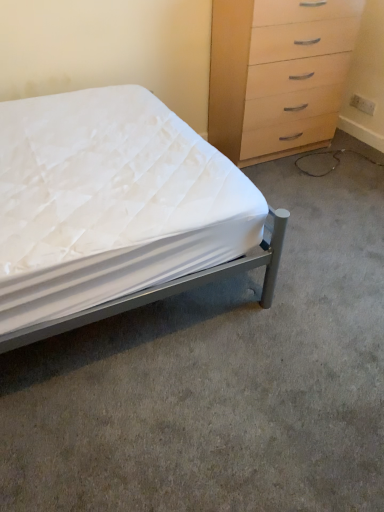
Question: Considering the relative sizes of light wood/wooden chest of drawers at upper right and metallic gray bed at left in the image provided, is light wood/wooden chest of drawers at upper right shorter than metallic gray bed at left?

Choices:
 (A) no
 (B) yes

Answer: (A)

Question: Considering the relative sizes of light wood/wooden chest of drawers at upper right and metallic gray bed at left in the image provided, is light wood/wooden chest of drawers at upper right smaller than metallic gray bed at left?

Choices:
 (A) yes
 (B) no

Answer: (A)

Question: Is light wood/wooden chest of drawers at upper right taller than metallic gray bed at left?

Choices:
 (A) yes
 (B) no

Answer: (A)

Question: Is the depth of light wood/wooden chest of drawers at upper right greater than that of metallic gray bed at left?

Choices:
 (A) no
 (B) yes

Answer: (B)

Question: From the image's perspective, is light wood/wooden chest of drawers at upper right over metallic gray bed at left?

Choices:
 (A) no
 (B) yes

Answer: (B)

Question: Considering the positions of light wood/wooden chest of drawers at upper right and white fabric bed at lower left in the image, is light wood/wooden chest of drawers at upper right wider or thinner than white fabric bed at lower left?

Choices:
 (A) thin
 (B) wide

Answer: (A)

Question: Is light wood/wooden chest of drawers at upper right in front of or behind white fabric bed at lower left in the image?

Choices:
 (A) behind
 (B) front

Answer: (A)

Question: Based on their sizes in the image, would you say light wood/wooden chest of drawers at upper right is bigger or smaller than white fabric bed at lower left?

Choices:
 (A) big
 (B) small

Answer: (A)

Question: From the image's perspective, relative to white fabric bed at lower left, is light wood/wooden chest of drawers at upper right above or below?

Choices:
 (A) below
 (B) above

Answer: (B)

Question: Considering the positions of metallic gray bed at left and white fabric bed at lower left in the image, is metallic gray bed at left taller or shorter than white fabric bed at lower left?

Choices:
 (A) short
 (B) tall

Answer: (B)

Question: Is metallic gray bed at left bigger or smaller than white fabric bed at lower left?

Choices:
 (A) small
 (B) big

Answer: (B)

Question: From a real-world perspective, relative to white fabric bed at lower left, is metallic gray bed at left vertically above or below?

Choices:
 (A) below
 (B) above

Answer: (B)

Question: From the image's perspective, is metallic gray bed at left above or below white fabric bed at lower left?

Choices:
 (A) above
 (B) below

Answer: (A)

Question: Is light wood/wooden chest of drawers at upper right taller or shorter than metallic gray bed at left?

Choices:
 (A) tall
 (B) short

Answer: (A)

Question: Does point (235, 94) appear closer or farther from the camera than point (226, 199)?

Choices:
 (A) farther
 (B) closer

Answer: (A)